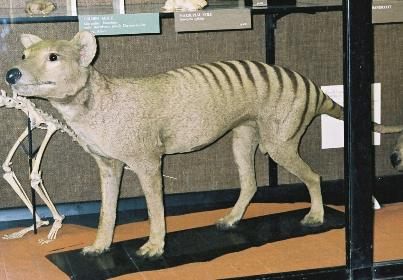
The height and width of the screenshot is (280, 403). I want to click on chest, so click(93, 141).